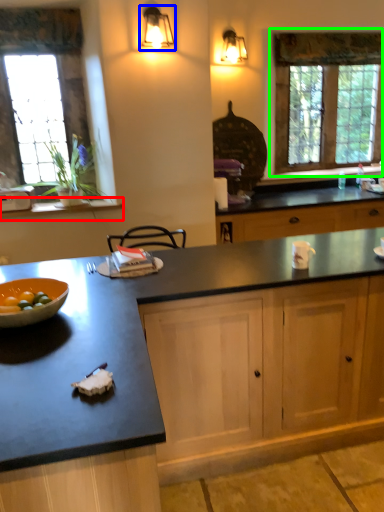
Question: Which is farther away from window sill (highlighted by a red box)? light fixture (highlighted by a blue box) or window (highlighted by a green box)?

Choices:
 (A) light fixture
 (B) window

Answer: (B)